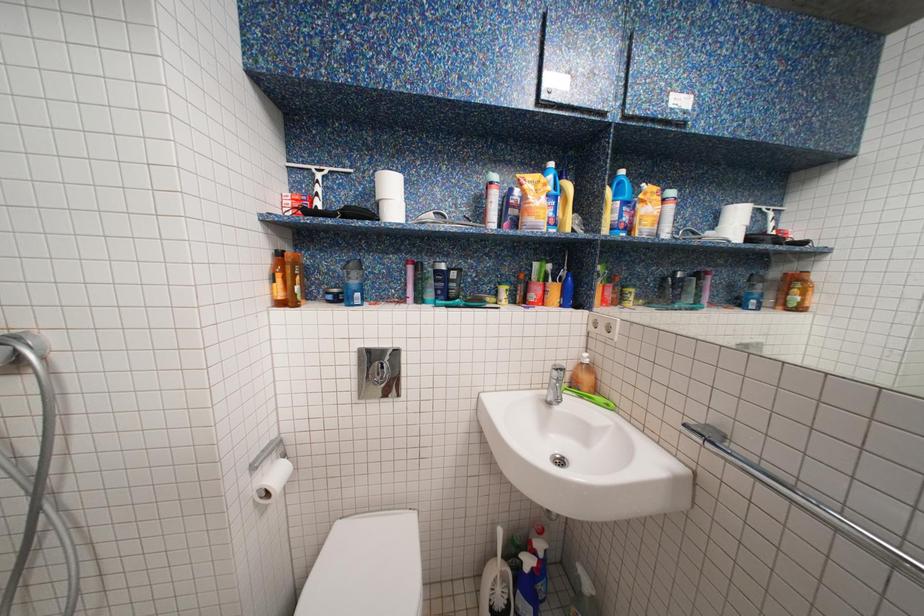
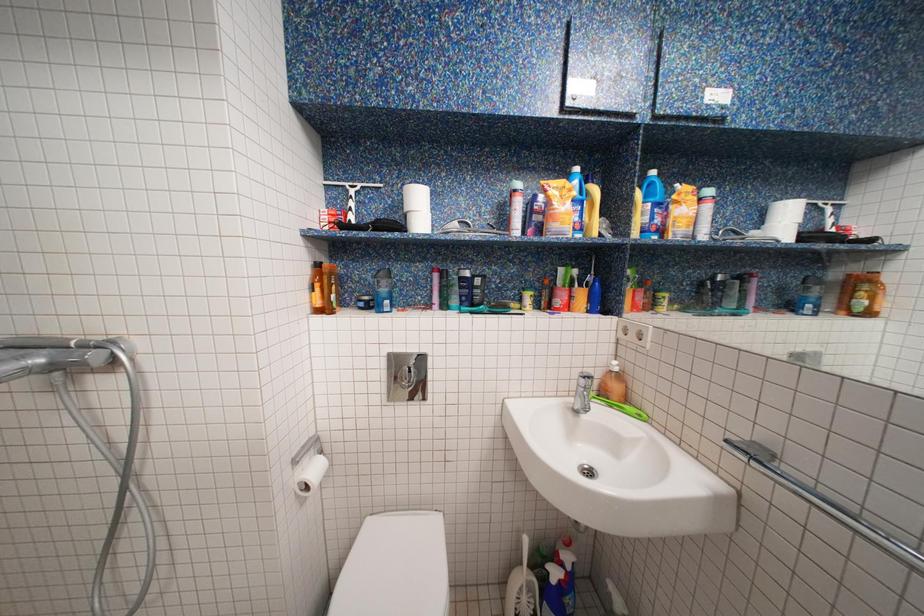
Question: How did the camera likely rotate?

Choices:
 (A) Left
 (B) Right
 (C) Up
 (D) Down

Answer: (A)